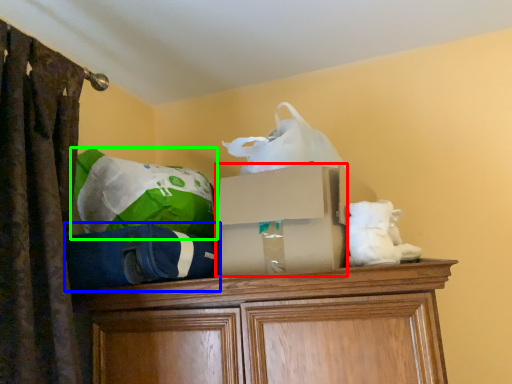
Question: Which is farther away from storage box (highlighted by a red box)? bean bag chair (highlighted by a blue box) or bean bag chair (highlighted by a green box)?

Choices:
 (A) bean bag chair
 (B) bean bag chair

Answer: (B)